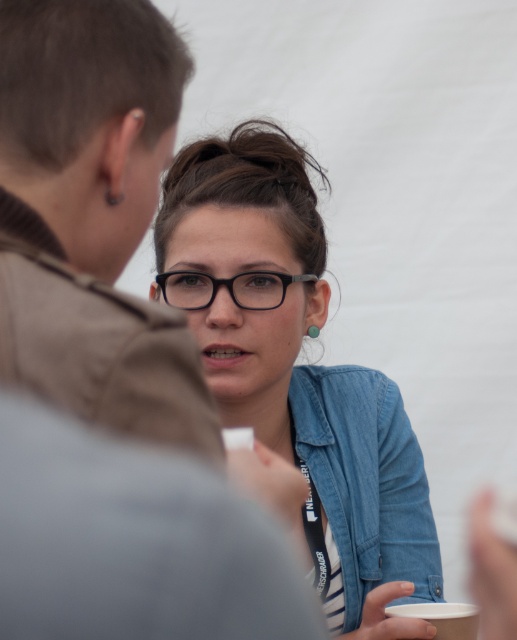
Question: Does matte black glasses at center have a greater width compared to white paper cup at lower right?

Choices:
 (A) yes
 (B) no

Answer: (A)

Question: Is denim jacket at lower right bigger than white paper cup at lower right?

Choices:
 (A) no
 (B) yes

Answer: (B)

Question: Which is farther from the matte black glasses at center?

Choices:
 (A) denim jacket at lower right
 (B) white paper cup at lower right

Answer: (B)

Question: Which object is the farthest from the black plastic glasses at center?

Choices:
 (A) matte black glasses at center
 (B) white paper cup at lower right

Answer: (B)

Question: Is denim jacket at lower right above white paper cup at lower right?

Choices:
 (A) yes
 (B) no

Answer: (A)

Question: Which is nearer to the denim jacket at lower right?

Choices:
 (A) white paper cup at lower right
 (B) black plastic glasses at center

Answer: (A)